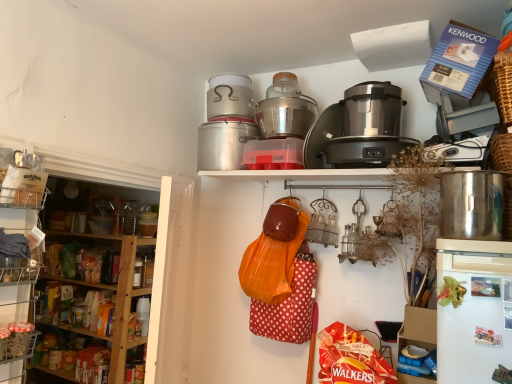
What do you see at coordinates (81, 301) in the screenshot? I see `wooden shelves at left, which ranks as the second shelf in left-to-right order` at bounding box center [81, 301].

What do you see at coordinates (362, 151) in the screenshot?
I see `black plastic food processor at upper center, acting as the first appliance starting from the left` at bounding box center [362, 151].

Identify the location of metallic silver toaster at upper right, the 2th appliance from the left. Image resolution: width=512 pixels, height=384 pixels. (459, 150).

You are a GUI agent. You are given a task and a screenshot of the screen. Output one action in this format:
    pyautogui.click(x=<x>, y=<y>)
    Task: Click on the blue cardboard box at upper right, the 1th appliance positioned from the right
    The height and width of the screenshot is (384, 512).
    Given the screenshot: What is the action you would take?
    pyautogui.click(x=464, y=117)

This screenshot has width=512, height=384. What are the coordinates of `brushed metal rice cooker at upper center, which appears as the 1th rice cooker when viewed from the left` in the screenshot? It's located at (x=229, y=97).

Considering the sizes of objects wooden shelves at left, which ranks as the second shelf in left-to-right order, and clear plastic basket at lower left, acting as the 3th shelf starting from the right, in the image provided, who is bigger, wooden shelves at left, which ranks as the second shelf in left-to-right order, or clear plastic basket at lower left, acting as the 3th shelf starting from the right,?

wooden shelves at left, which ranks as the second shelf in left-to-right order.

Considering the sizes of wooden shelves at left, which ranks as the second shelf in left-to-right order, and clear plastic basket at lower left, which appears as the first shelf when viewed from the left, in the image, is wooden shelves at left, which ranks as the second shelf in left-to-right order, wider or thinner than clear plastic basket at lower left, which appears as the first shelf when viewed from the left,?

Clearly, wooden shelves at left, which ranks as the second shelf in left-to-right order, has more width compared to clear plastic basket at lower left, which appears as the first shelf when viewed from the left.

Is point (47, 272) closer or farther from the camera than point (15, 299)?

Point (47, 272) is farther from the camera than point (15, 299).

From the image's perspective, which object appears higher, wooden shelves at left, which ranks as the second shelf in left-to-right order, or clear plastic basket at lower left, acting as the 3th shelf starting from the right?

wooden shelves at left, which ranks as the second shelf in left-to-right order, appears higher in the image.

Is clear plastic basket at lower left, acting as the 3th shelf starting from the right, far away from silver metallic crock pot at upper center?

Yes, clear plastic basket at lower left, acting as the 3th shelf starting from the right, is far from silver metallic crock pot at upper center.

Locate an element on the screen. crock pot to the right of clear plastic basket at lower left, acting as the 3th shelf starting from the right is located at coordinates (224, 142).

Is clear plastic basket at lower left, which appears as the first shelf when viewed from the left, positioned behind silver metallic crock pot at upper center?

No.

In terms of width, does blue plastic tray at lower right, the first shelf in the right-to-left sequence, look wider or thinner when compared to black plastic food processor at upper center, arranged as the 3th appliance when viewed from the right?

blue plastic tray at lower right, the first shelf in the right-to-left sequence, is wider than black plastic food processor at upper center, arranged as the 3th appliance when viewed from the right.

Which is correct: blue plastic tray at lower right, the first shelf in the right-to-left sequence, is inside black plastic food processor at upper center, arranged as the 3th appliance when viewed from the right, or outside of it?

blue plastic tray at lower right, the first shelf in the right-to-left sequence, is spatially situated outside black plastic food processor at upper center, arranged as the 3th appliance when viewed from the right.

Consider the image. From a real-world perspective, is blue plastic tray at lower right, the first shelf in the right-to-left sequence, under black plastic food processor at upper center, acting as the first appliance starting from the left?

Yes, from a real-world perspective, blue plastic tray at lower right, the first shelf in the right-to-left sequence, is beneath black plastic food processor at upper center, acting as the first appliance starting from the left.

Does blue plastic tray at lower right, the first shelf in the right-to-left sequence, appear on the right side of black plastic food processor at upper center, acting as the first appliance starting from the left?

Yes, blue plastic tray at lower right, the first shelf in the right-to-left sequence, is to the right of black plastic food processor at upper center, acting as the first appliance starting from the left.

Would you say stainless steel pot at right is inside or outside brushed metal rice cooker at upper center, which ranks as the 3th rice cooker in right-to-left order?

stainless steel pot at right is spatially situated outside brushed metal rice cooker at upper center, which ranks as the 3th rice cooker in right-to-left order.

How many degrees apart are the facing directions of stainless steel pot at right and brushed metal rice cooker at upper center, which appears as the 1th rice cooker when viewed from the left?

0.652 degrees.

Does point (486, 197) come in front of point (229, 75)?

Yes, it is in front of point (229, 75).

From the picture: Considering the sizes of stainless steel pot at right and brushed metal rice cooker at upper center, which ranks as the 3th rice cooker in right-to-left order, in the image, is stainless steel pot at right bigger or smaller than brushed metal rice cooker at upper center, which ranks as the 3th rice cooker in right-to-left order,?

stainless steel pot at right is smaller than brushed metal rice cooker at upper center, which ranks as the 3th rice cooker in right-to-left order.

Which object is thinner, brushed metal rice cooker at upper center, which ranks as the 3th rice cooker in right-to-left order, or satin silver rice cooker at upper center, the first rice cooker viewed from the right?

satin silver rice cooker at upper center, the first rice cooker viewed from the right.

Considering the sizes of brushed metal rice cooker at upper center, which appears as the 1th rice cooker when viewed from the left, and satin silver rice cooker at upper center, the first rice cooker viewed from the right, in the image, is brushed metal rice cooker at upper center, which appears as the 1th rice cooker when viewed from the left, bigger or smaller than satin silver rice cooker at upper center, the first rice cooker viewed from the right,?

Clearly, brushed metal rice cooker at upper center, which appears as the 1th rice cooker when viewed from the left, is smaller in size than satin silver rice cooker at upper center, the first rice cooker viewed from the right.

From a real-world perspective, is brushed metal rice cooker at upper center, which ranks as the 3th rice cooker in right-to-left order, physically above satin silver rice cooker at upper center, the 3th rice cooker viewed from the left?

Yes, from a real-world perspective, brushed metal rice cooker at upper center, which ranks as the 3th rice cooker in right-to-left order, is on top of satin silver rice cooker at upper center, the 3th rice cooker viewed from the left.

Is satin silver rice cooker at upper center, the first rice cooker viewed from the right, facing towards silver metallic rice cooker at upper center, the 2th rice cooker when ordered from left to right?

No, satin silver rice cooker at upper center, the first rice cooker viewed from the right, is not turned towards silver metallic rice cooker at upper center, the 2th rice cooker when ordered from left to right.

Is satin silver rice cooker at upper center, the 3th rice cooker viewed from the left, next to silver metallic rice cooker at upper center, which is the 2th rice cooker from right to left, and touching it?

satin silver rice cooker at upper center, the 3th rice cooker viewed from the left, and silver metallic rice cooker at upper center, which is the 2th rice cooker from right to left, are not in contact.

From the picture: From the image's perspective, is satin silver rice cooker at upper center, the first rice cooker viewed from the right, above or below silver metallic rice cooker at upper center, the 2th rice cooker when ordered from left to right?

From the image's perspective, satin silver rice cooker at upper center, the first rice cooker viewed from the right, appears below silver metallic rice cooker at upper center, the 2th rice cooker when ordered from left to right.

Can you tell me how much satin silver rice cooker at upper center, the 3th rice cooker viewed from the left, and silver metallic rice cooker at upper center, which is the 2th rice cooker from right to left, differ in facing direction?

The angle between the facing direction of satin silver rice cooker at upper center, the 3th rice cooker viewed from the left, and the facing direction of silver metallic rice cooker at upper center, which is the 2th rice cooker from right to left, is 0.000216 degrees.

Locate an element on the screen. The width and height of the screenshot is (512, 384). appliance on the left of the metallic silver toaster at upper right, which appears as the second appliance when viewed from the right is located at coordinates (362, 151).

Would you say black plastic food processor at upper center, arranged as the 3th appliance when viewed from the right, is part of metallic silver toaster at upper right, which appears as the second appliance when viewed from the right,'s contents?

No, black plastic food processor at upper center, arranged as the 3th appliance when viewed from the right, is located outside of metallic silver toaster at upper right, which appears as the second appliance when viewed from the right.

From a real-world perspective, which object rests below the other?

From a 3D spatial view, metallic silver toaster at upper right, which appears as the second appliance when viewed from the right, is below.

How many degrees apart are the facing directions of metallic silver toaster at upper right, which appears as the second appliance when viewed from the right, and black plastic food processor at upper center, arranged as the 3th appliance when viewed from the right?

There is a 0.00056-degree angle between the facing directions of metallic silver toaster at upper right, which appears as the second appliance when viewed from the right, and black plastic food processor at upper center, arranged as the 3th appliance when viewed from the right.

What are the coordinates of `shelf that is the 1st object directly below the wooden shelves at left, which ranks as the second shelf in right-to-left order (from a real-world perspective)` in the screenshot? It's located at (x=16, y=320).

The width and height of the screenshot is (512, 384). What are the coordinates of `shelf that is the 2nd one when counting downward from the silver metallic crock pot at upper center (from the image's perspective)` in the screenshot? It's located at (16, 320).

Which object lies nearer to the anchor point brushed metal rice cooker at upper center, which ranks as the 3th rice cooker in right-to-left order, metallic silver toaster at upper right, which appears as the second appliance when viewed from the right, or satin silver rice cooker at upper center, the first rice cooker viewed from the right?

Based on the image, satin silver rice cooker at upper center, the first rice cooker viewed from the right, appears to be nearer to brushed metal rice cooker at upper center, which ranks as the 3th rice cooker in right-to-left order.

Based on their spatial positions, is wooden shelves at left, which ranks as the second shelf in left-to-right order, or stainless steel pot at right further from blue plastic tray at lower right, acting as the third shelf starting from the left?

The object further to blue plastic tray at lower right, acting as the third shelf starting from the left, is wooden shelves at left, which ranks as the second shelf in left-to-right order.

Which object lies further to the anchor point metallic silver toaster at upper right, the 2th appliance from the left, black plastic food processor at upper center, acting as the first appliance starting from the left, or blue cardboard box at upper right, the 1th appliance positioned from the right?

Among the two, black plastic food processor at upper center, acting as the first appliance starting from the left, is located further to metallic silver toaster at upper right, the 2th appliance from the left.

When comparing their distances from clear plastic basket at lower left, acting as the 3th shelf starting from the right, does metallic silver toaster at upper right, which appears as the second appliance when viewed from the right, or blue cardboard box at upper right, marked as the 3th appliance in a left-to-right arrangement, seem closer?

The object closer to clear plastic basket at lower left, acting as the 3th shelf starting from the right, is metallic silver toaster at upper right, which appears as the second appliance when viewed from the right.

From the picture: Which object lies further to the anchor point wooden shelves at left, which ranks as the second shelf in left-to-right order, satin silver rice cooker at upper center, the 3th rice cooker viewed from the left, or clear plastic basket at lower left, acting as the 3th shelf starting from the right?

satin silver rice cooker at upper center, the 3th rice cooker viewed from the left, lies further to wooden shelves at left, which ranks as the second shelf in left-to-right order, than the other object.

Considering their positions, is satin silver rice cooker at upper center, the first rice cooker viewed from the right, positioned further to black plastic food processor at upper center, arranged as the 3th appliance when viewed from the right, than brushed metal rice cooker at upper center, which appears as the 1th rice cooker when viewed from the left?

brushed metal rice cooker at upper center, which appears as the 1th rice cooker when viewed from the left, is positioned further to the anchor black plastic food processor at upper center, arranged as the 3th appliance when viewed from the right.

Based on their spatial positions, is stainless steel pot at right or blue plastic tray at lower right, acting as the third shelf starting from the left, further from brushed metal rice cooker at upper center, which appears as the 1th rice cooker when viewed from the left?

Among the two, blue plastic tray at lower right, acting as the third shelf starting from the left, is located further to brushed metal rice cooker at upper center, which appears as the 1th rice cooker when viewed from the left.

Estimate the real-world distances between objects in this image. Which object is closer to blue plastic tray at lower right, acting as the third shelf starting from the left, blue cardboard box at upper right, marked as the 3th appliance in a left-to-right arrangement, or wooden shelves at left, which ranks as the second shelf in left-to-right order?

blue cardboard box at upper right, marked as the 3th appliance in a left-to-right arrangement, is closer to blue plastic tray at lower right, acting as the third shelf starting from the left.

You are a GUI agent. You are given a task and a screenshot of the screen. Output one action in this format:
    pyautogui.click(x=<x>, y=<y>)
    Task: Click on the crock pot between satin silver rice cooker at upper center, the first rice cooker viewed from the right, and blue plastic tray at lower right, acting as the third shelf starting from the left, vertically
    
    Given the screenshot: What is the action you would take?
    pyautogui.click(x=224, y=142)

Identify the location of rice cooker located between silver metallic rice cooker at upper center, which is the 2th rice cooker from right to left, and blue cardboard box at upper right, marked as the 3th appliance in a left-to-right arrangement, in the left-right direction. Image resolution: width=512 pixels, height=384 pixels. (372, 109).

Image resolution: width=512 pixels, height=384 pixels. I want to click on kitchen appliance between silver metallic rice cooker at upper center, which is the 2th rice cooker from right to left, and blue plastic tray at lower right, the first shelf in the right-to-left sequence, in the up-down direction, so click(472, 204).

Where is `crock pot between wooden shelves at left, which ranks as the second shelf in left-to-right order, and stainless steel pot at right from left to right`? crock pot between wooden shelves at left, which ranks as the second shelf in left-to-right order, and stainless steel pot at right from left to right is located at coordinates (224, 142).